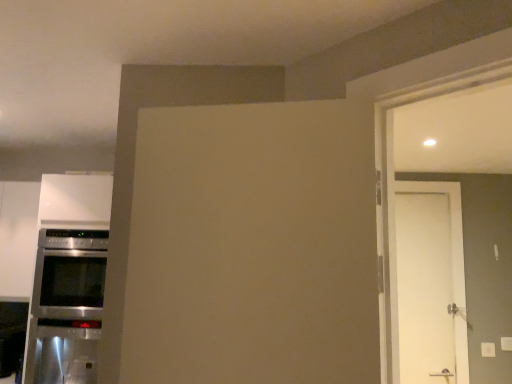
Image resolution: width=512 pixels, height=384 pixels. What do you see at coordinates (66, 307) in the screenshot?
I see `stainless steel oven at left` at bounding box center [66, 307].

You are a GUI agent. You are given a task and a screenshot of the screen. Output one action in this format:
    pyautogui.click(x=<x>, y=<y>)
    Task: Click on the stainless steel oven at left
    
    Given the screenshot: What is the action you would take?
    pyautogui.click(x=66, y=307)

The width and height of the screenshot is (512, 384). Find the location of `white matte door at right`. white matte door at right is located at coordinates (424, 288).

This screenshot has width=512, height=384. What do you see at coordinates (424, 288) in the screenshot? I see `white matte door at right` at bounding box center [424, 288].

You are a GUI agent. You are given a task and a screenshot of the screen. Output one action in this format:
    pyautogui.click(x=<x>, y=<y>)
    Task: Click on the stainless steel oven at left
    Image resolution: width=512 pixels, height=384 pixels.
    Given the screenshot: What is the action you would take?
    pyautogui.click(x=66, y=307)

Considering the positions of objects stainless steel oven at left and white matte door at right in the image provided, who is more to the left, stainless steel oven at left or white matte door at right?

Positioned to the left is stainless steel oven at left.

Does stainless steel oven at left lie behind white matte door at right?

No, the depth of stainless steel oven at left is less than that of white matte door at right.

Is point (38, 334) positioned after point (441, 205)?

No, (38, 334) is in front of (441, 205).

From the image's perspective, is stainless steel oven at left under white matte door at right?

Indeed, from the image's perspective, stainless steel oven at left is shown beneath white matte door at right.

From a real-world perspective, between stainless steel oven at left and white matte door at right, who is vertically higher?

white matte door at right.

Consider the image. Between stainless steel oven at left and white matte door at right, which one has larger width?

stainless steel oven at left is wider.

Can you confirm if stainless steel oven at left is taller than white matte door at right?

In fact, stainless steel oven at left may be shorter than white matte door at right.

Is stainless steel oven at left bigger or smaller than white matte door at right?

stainless steel oven at left is bigger than white matte door at right.

Is stainless steel oven at left not inside white matte door at right?

Yes, stainless steel oven at left is located beyond the bounds of white matte door at right.

Are stainless steel oven at left and white matte door at right located far from each other?

Yes, stainless steel oven at left and white matte door at right are quite far apart.

Is stainless steel oven at left positioned with its back to white matte door at right?

No.

At what (x,y) coordinates should I click in order to perform the action: click on door above the stainless steel oven at left (from the image's perspective). Please return your answer as a coordinate pair (x, y). Looking at the image, I should click on (424, 288).

Considering the relative positions of white matte door at right and stainless steel oven at left in the image provided, is white matte door at right to the left of stainless steel oven at left from the viewer's perspective?

No.

Is white matte door at right further to the viewer compared to stainless steel oven at left?

That is True.

Does point (448, 331) appear closer or farther from the camera than point (30, 351)?

Point (448, 331).

From the image's perspective, would you say white matte door at right is positioned over stainless steel oven at left?

Yes, from the image's perspective, white matte door at right is over stainless steel oven at left.

From the picture: From a real-world perspective, is white matte door at right beneath stainless steel oven at left?

No, from a real-world perspective, white matte door at right is not under stainless steel oven at left.

From the picture: Can you confirm if white matte door at right is thinner than stainless steel oven at left?

Indeed, white matte door at right has a lesser width compared to stainless steel oven at left.

Considering the sizes of objects white matte door at right and stainless steel oven at left in the image provided, who is taller, white matte door at right or stainless steel oven at left?

Standing taller between the two is white matte door at right.

Considering the relative sizes of white matte door at right and stainless steel oven at left in the image provided, is white matte door at right smaller than stainless steel oven at left?

Yes.

Is stainless steel oven at left surrounded by white matte door at right?

No.

Is white matte door at right not near stainless steel oven at left?

Indeed, white matte door at right is not near stainless steel oven at left.

Does white matte door at right turn towards stainless steel oven at left?

No, white matte door at right is not turned towards stainless steel oven at left.

What's the angular difference between white matte door at right and stainless steel oven at left's facing directions?

They differ by 0.00805 degrees in their facing directions.

At what (x,y) coordinates should I click in order to perform the action: click on home appliance that appears below the white matte door at right (from the image's perspective). Please return your answer as a coordinate pair (x, y). This screenshot has height=384, width=512. Looking at the image, I should click on (66, 307).

This screenshot has height=384, width=512. What are the coordinates of `home appliance on the left of white matte door at right` in the screenshot? It's located at (66, 307).

Where is `door above the stainless steel oven at left (from a real-world perspective)`? door above the stainless steel oven at left (from a real-world perspective) is located at coordinates (424, 288).